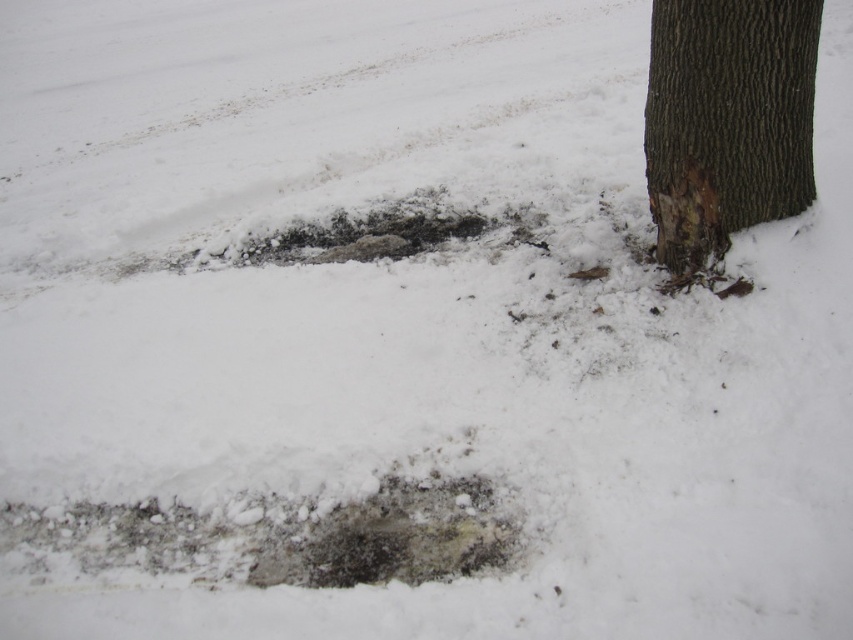
You are an explorer in a snowy area and need to decide which object to step on first. Based on their sizes, which one should you choose between the brown rough bark at right and the dark gray stone hole at center?

The brown rough bark at right is larger in size than the dark gray stone hole at center, so stepping on the brown rough bark at right would be safer due to its larger surface area.

You are standing in the snowy landscape and want to walk from the point at coordinates point(756, 65) to the point at coordinates point(350, 508). Which direction should you move to get closer to your destination?

Since point(756, 65) is further to the camera than point(350, 508), you should move towards the direction away from you to reach the destination point(350, 508).